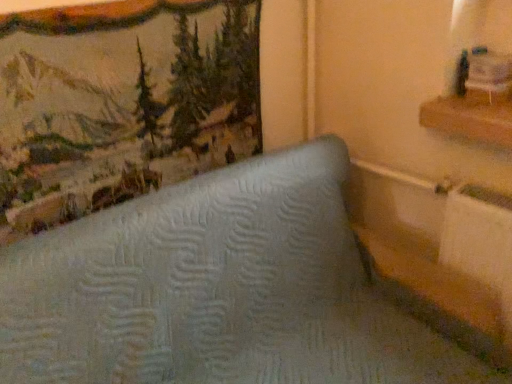
Question: From a real-world perspective, is wooden shelf at upper right above or below light blue quilted mattress at center?

Choices:
 (A) above
 (B) below

Answer: (A)

Question: In the image, is wooden shelf at upper right positioned in front of or behind light blue quilted mattress at center?

Choices:
 (A) behind
 (B) front

Answer: (A)

Question: Which object is positioned farthest from the light blue quilted mattress at center?

Choices:
 (A) wooden shelf at upper right
 (B) textured fabric picture frame at upper left

Answer: (A)

Question: Based on their relative distances, which object is farther from the wooden shelf at upper right?

Choices:
 (A) textured fabric picture frame at upper left
 (B) light blue quilted mattress at center

Answer: (A)